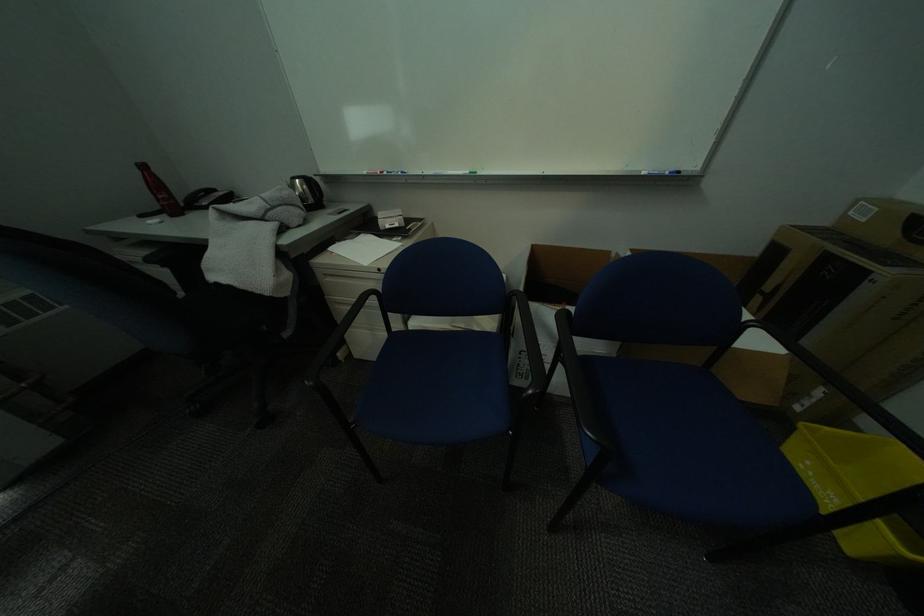
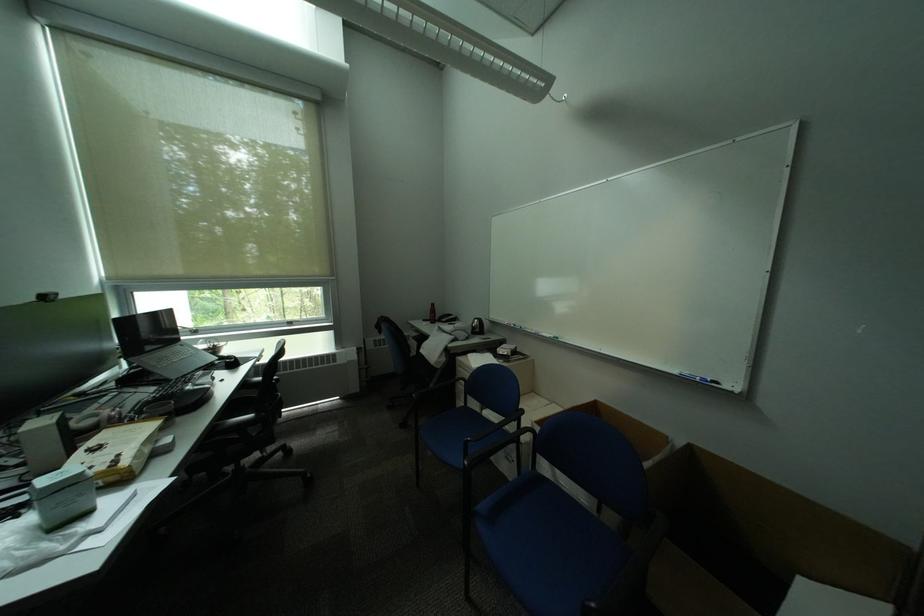
How did the camera likely rotate?

The rotation direction of the camera is left-up.